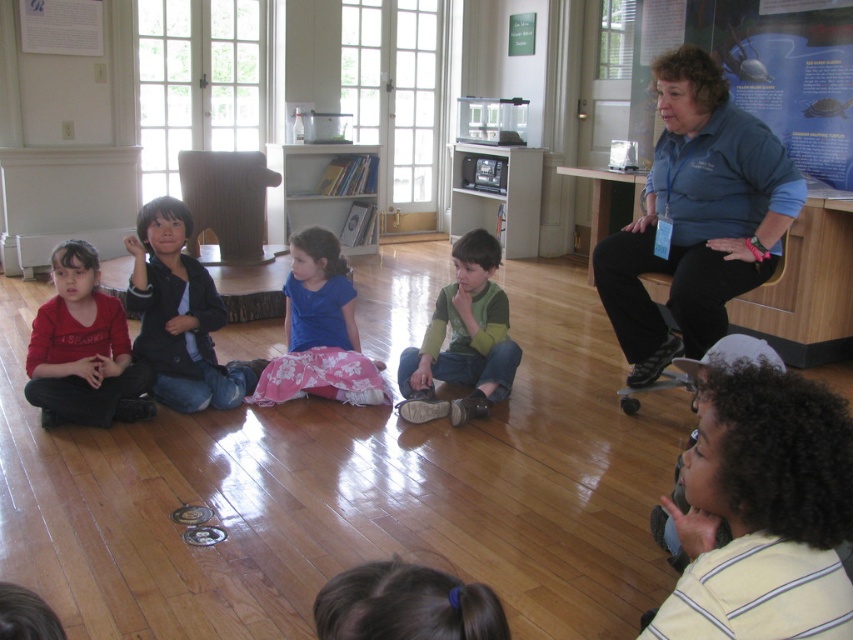
You are a photographer trying to capture a photo of the blue cotton shirt at upper right without including the matte red shirt at lower left in the frame. Based on their positions, is this possible?

The blue cotton shirt at upper right is in front of the matte red shirt at lower left, so it is possible to capture a photo of the blue cotton shirt at upper right without including the matte red shirt at lower left by focusing on the front position of the blue cotton shirt at upper right.

You are a photographer trying to capture a candid shot of the children in the scene. You notice two children wearing the yellow striped shirt at lower right and the blue cotton shirt at upper right. Which child would require a wider angle lens to capture their entire outfit in the photo?

The blue cotton shirt at upper right requires a wider angle lens because it occupies more space than the yellow striped shirt at lower right, so capturing its entire outfit would need a wider field of view.

You are a photographer trying to capture a group photo of the children and the educators in the scene. You want to ensure that both the blue cotton shirt at upper right and the matte red shirt at lower left are clearly visible in the photo. Given their sizes, which shirt should you focus on framing first to ensure it doesn

The blue cotton shirt at upper right is larger in size compared to the matte red shirt at lower left. Therefore, you should focus on framing the blue cotton shirt at upper right first to ensure it is properly centered and visible, as its larger size makes it more prominent in the scene.